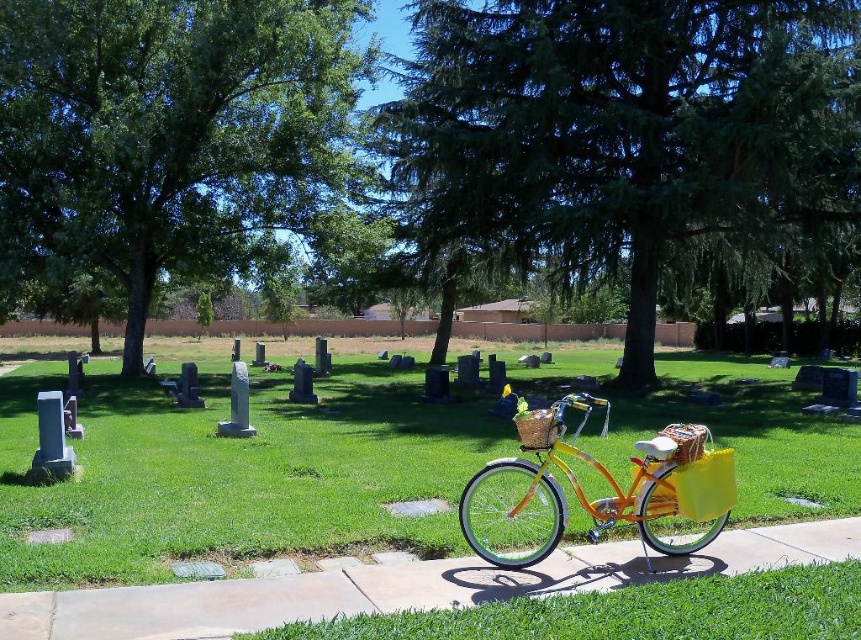
Question: Which of the following is the farthest from the observer?

Choices:
 (A) green grass at center
 (B) green leafy tree at upper left
 (C) yellow matte bicycle at center
 (D) green needle-like leaves at center

Answer: (B)

Question: Does green needle-like leaves at center appear under orange matte pavement at lower center?

Choices:
 (A) no
 (B) yes

Answer: (A)

Question: Which of these objects is positioned farthest from the green needle-like leaves at center?

Choices:
 (A) yellow woven basket at center
 (B) green leafy tree at upper left
 (C) green grass at center

Answer: (A)

Question: Can you confirm if orange matte pavement at lower center is positioned to the right of matte wicker basket at center?

Choices:
 (A) yes
 (B) no

Answer: (B)

Question: Which point is farther to the camera?

Choices:
 (A) green needle-like leaves at center
 (B) green grass at center
 (C) green leafy tree at upper left

Answer: (C)

Question: Does orange matte pavement at lower center appear on the left side of yellow matte bicycle at center?

Choices:
 (A) yes
 (B) no

Answer: (A)